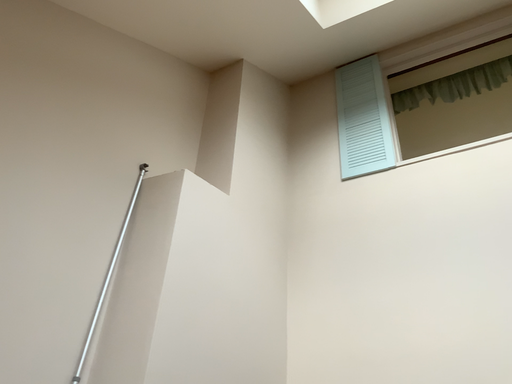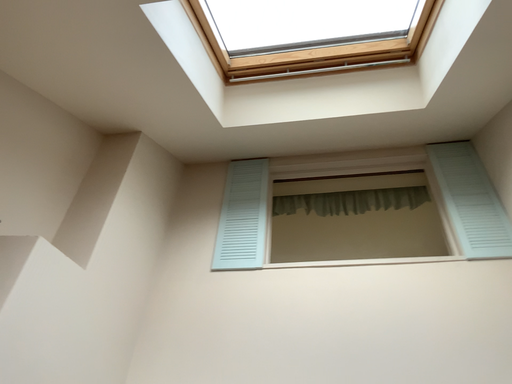
Question: Which way did the camera rotate in the video?

Choices:
 (A) rotated left
 (B) rotated right

Answer: (B)